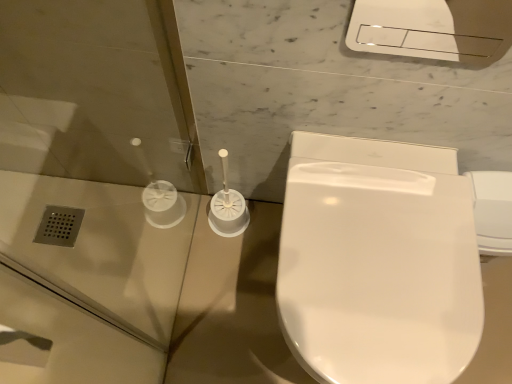
The image size is (512, 384). In order to click on free space above white glossy toilet at center (from a real-world perspective) in this screenshot , I will do pos(380,250).